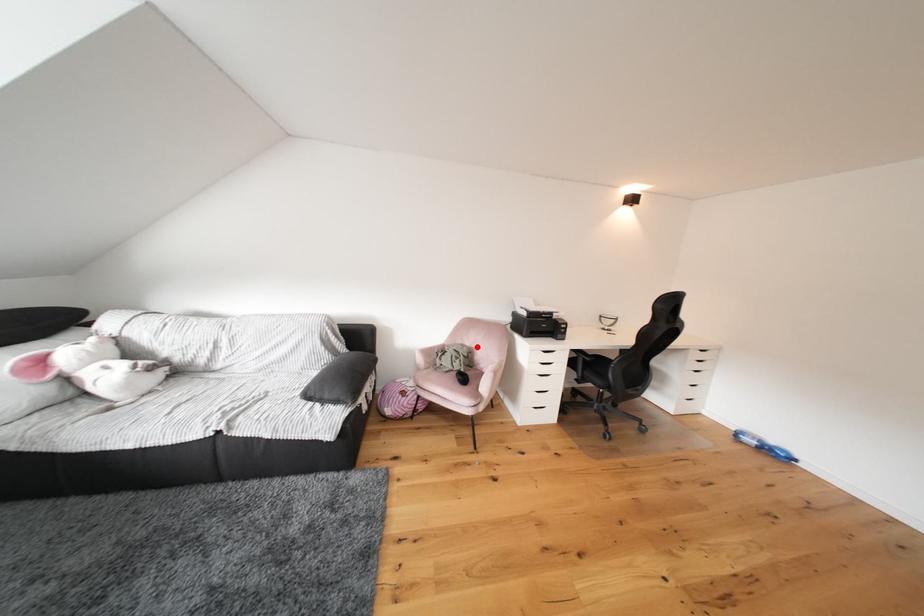
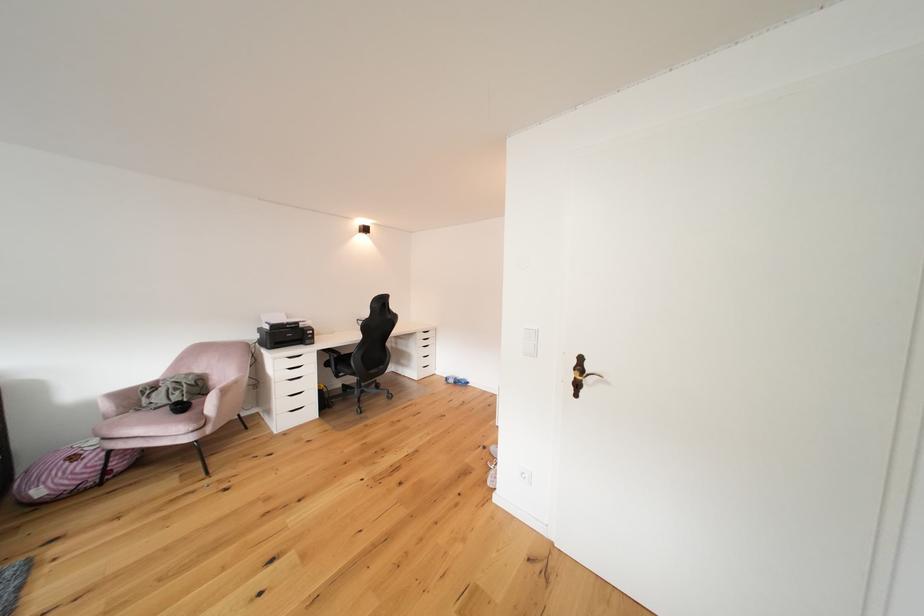
Locate, in the second image, the point that corresponds to the highlighted location in the first image.

(208, 374)